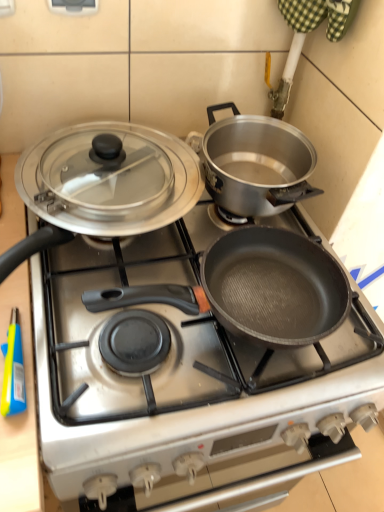
The height and width of the screenshot is (512, 384). Describe the element at coordinates (184, 379) in the screenshot. I see `non-stick black pan at center` at that location.

The height and width of the screenshot is (512, 384). In order to click on non-stick black pan at center in this screenshot , I will do `click(184, 379)`.

At what (x,y) coordinates should I click in order to perform the action: click on shiny silver lid at upper left. Please return your answer as a coordinate pair (x, y). This screenshot has width=384, height=512. Looking at the image, I should click on (103, 184).

Describe the element at coordinates (103, 184) in the screenshot. The width and height of the screenshot is (384, 512). I see `shiny silver lid at upper left` at that location.

This screenshot has height=512, width=384. I want to click on non-stick black pan at center, so click(x=184, y=379).

Between shiny silver lid at upper left and non-stick black pan at center, which one appears on the left side from the viewer's perspective?

shiny silver lid at upper left.

Considering their positions, is shiny silver lid at upper left located in front of or behind non-stick black pan at center?

shiny silver lid at upper left is behind non-stick black pan at center.

Is point (96, 182) positioned in front of point (202, 338)?

No, (96, 182) is further to viewer.

From the image's perspective, between shiny silver lid at upper left and non-stick black pan at center, who is located below?

non-stick black pan at center, from the image's perspective.

From a real-world perspective, is shiny silver lid at upper left located higher than non-stick black pan at center?

Correct, in the physical world, shiny silver lid at upper left is higher than non-stick black pan at center.

Considering the sizes of objects shiny silver lid at upper left and non-stick black pan at center in the image provided, who is wider, shiny silver lid at upper left or non-stick black pan at center?

Wider between the two is non-stick black pan at center.

Can you confirm if shiny silver lid at upper left is shorter than non-stick black pan at center?

Indeed, shiny silver lid at upper left has a lesser height compared to non-stick black pan at center.

Considering the sizes of objects shiny silver lid at upper left and non-stick black pan at center in the image provided, who is smaller, shiny silver lid at upper left or non-stick black pan at center?

shiny silver lid at upper left.

Is shiny silver lid at upper left outside of non-stick black pan at center?

That's correct, shiny silver lid at upper left is outside of non-stick black pan at center.

Is there a large distance between shiny silver lid at upper left and non-stick black pan at center?

shiny silver lid at upper left is near non-stick black pan at center, not far away.

From the picture: Is shiny silver lid at upper left facing towards non-stick black pan at center?

No, shiny silver lid at upper left does not turn towards non-stick black pan at center.

The height and width of the screenshot is (512, 384). In the image, there is a shiny silver lid at upper left. In order to click on gas stove below it (from the image's perspective) in this screenshot , I will do `click(184, 379)`.

From the picture: Can you confirm if non-stick black pan at center is positioned to the right of shiny silver lid at upper left?

Correct, you'll find non-stick black pan at center to the right of shiny silver lid at upper left.

Is non-stick black pan at center further to camera compared to shiny silver lid at upper left?

No, it is not.

Considering the positions of point (317, 414) and point (117, 218), is point (317, 414) closer or farther from the camera than point (117, 218)?

Point (317, 414) is closer to the camera than point (117, 218).

From the image's perspective, would you say non-stick black pan at center is shown under shiny silver lid at upper left?

Yes.

From a real-world perspective, is non-stick black pan at center on top of shiny silver lid at upper left?

No.

Which object is wider, non-stick black pan at center or shiny silver lid at upper left?

non-stick black pan at center.

Who is shorter, non-stick black pan at center or shiny silver lid at upper left?

Standing shorter between the two is shiny silver lid at upper left.

Between non-stick black pan at center and shiny silver lid at upper left, which one has smaller size?

With smaller size is shiny silver lid at upper left.

Is non-stick black pan at center spatially inside shiny silver lid at upper left, or outside of it?

non-stick black pan at center is outside shiny silver lid at upper left.

Is non-stick black pan at center not close to shiny silver lid at upper left?

They are positioned close to each other.

Is non-stick black pan at center oriented away from shiny silver lid at upper left?

No.

You are a GUI agent. You are given a task and a screenshot of the screen. Output one action in this format:
    pyautogui.click(x=<x>, y=<y>)
    Task: Click on the kitchen appliance that appears above the non-stick black pan at center (from the image's perspective)
    Image resolution: width=384 pixels, height=512 pixels.
    Given the screenshot: What is the action you would take?
    pyautogui.click(x=103, y=184)

This screenshot has width=384, height=512. In the image, there is a shiny silver lid at upper left. Identify the location of gas stove below it (from the image's perspective). (184, 379).

Image resolution: width=384 pixels, height=512 pixels. Find the location of `kitchen appliance located above the non-stick black pan at center (from the image's perspective)`. kitchen appliance located above the non-stick black pan at center (from the image's perspective) is located at coordinates (103, 184).